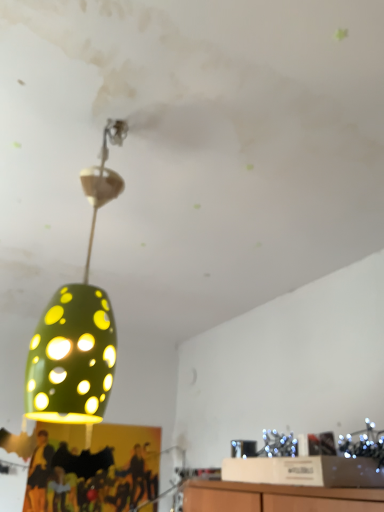
Question: In terms of height, does yellow fabric person at lower left look taller or shorter compared to green matte/porcelain lampshade at upper left?

Choices:
 (A) tall
 (B) short

Answer: (B)

Question: Is yellow fabric person at lower left spatially inside green matte/porcelain lampshade at upper left, or outside of it?

Choices:
 (A) inside
 (B) outside

Answer: (B)

Question: Which of these objects is positioned closest to the green matte lampshade at center?

Choices:
 (A) yellow fabric person at lower left
 (B) green matte/porcelain lampshade at upper left

Answer: (B)

Question: Estimate the real-world distances between objects in this image. Which object is closer to the green matte lampshade at center?

Choices:
 (A) green matte/porcelain lampshade at upper left
 (B) yellow fabric person at lower left

Answer: (A)